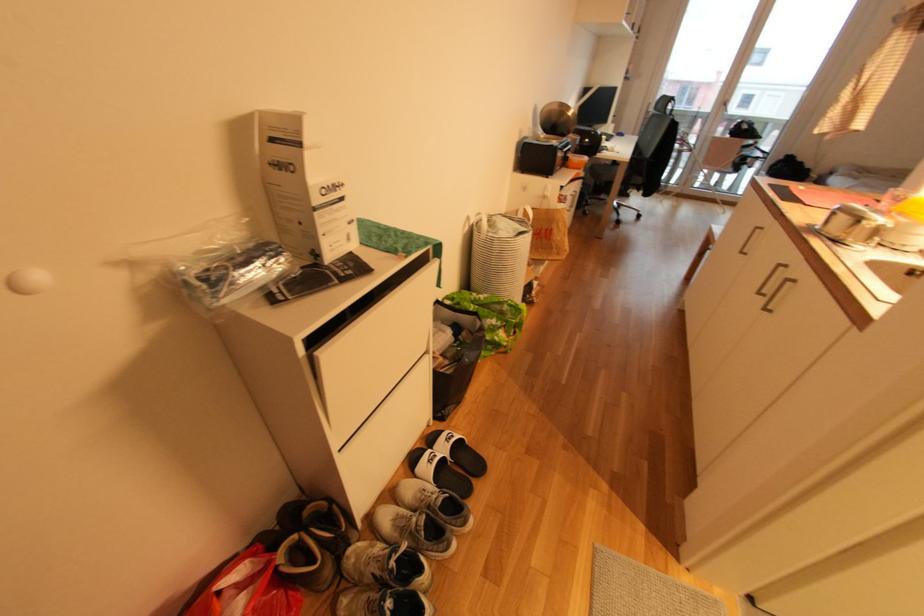
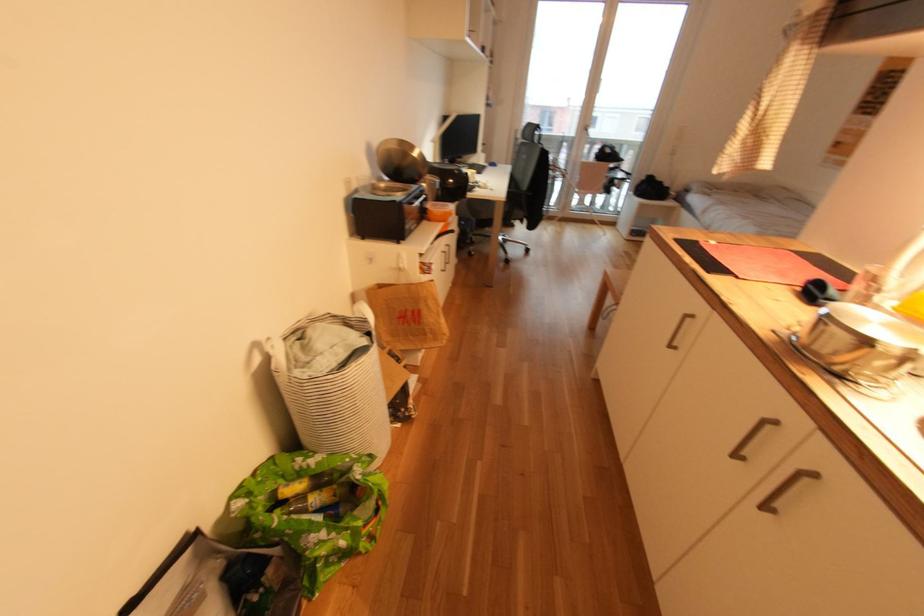
Which direction would the cameraman need to move to produce the second image?

The movement direction of the cameraman is right, forward.